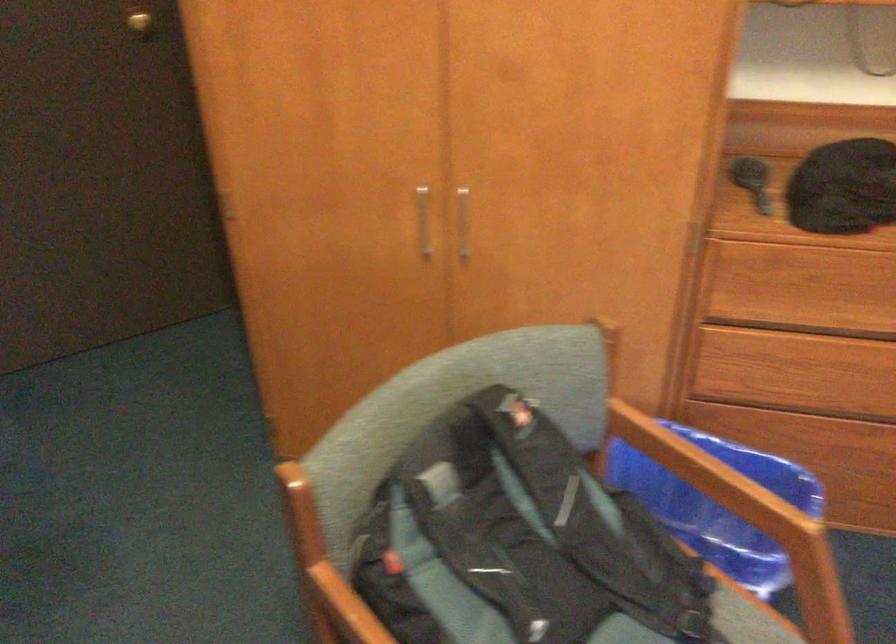
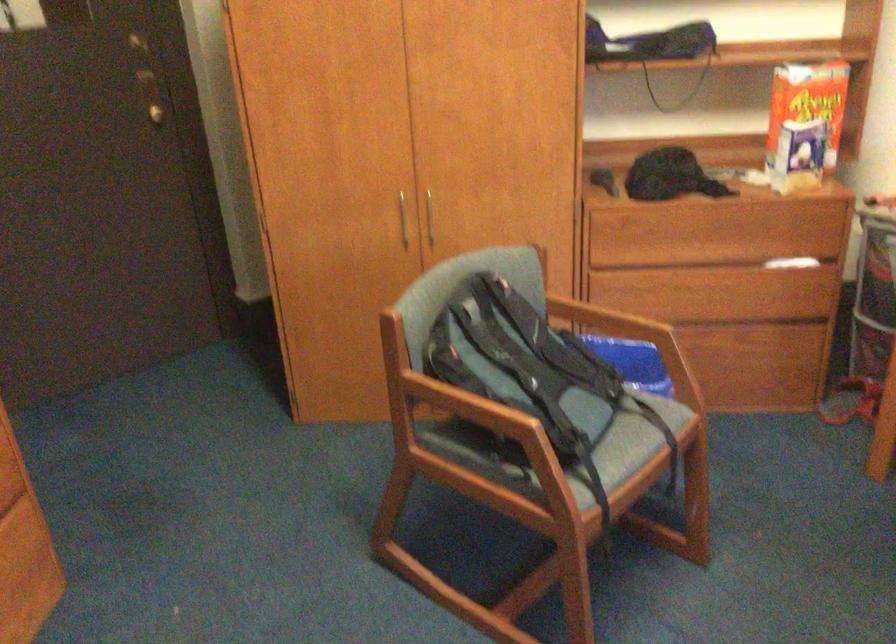
Find the pixel in the second image that matches (469,216) in the first image.

(428, 218)